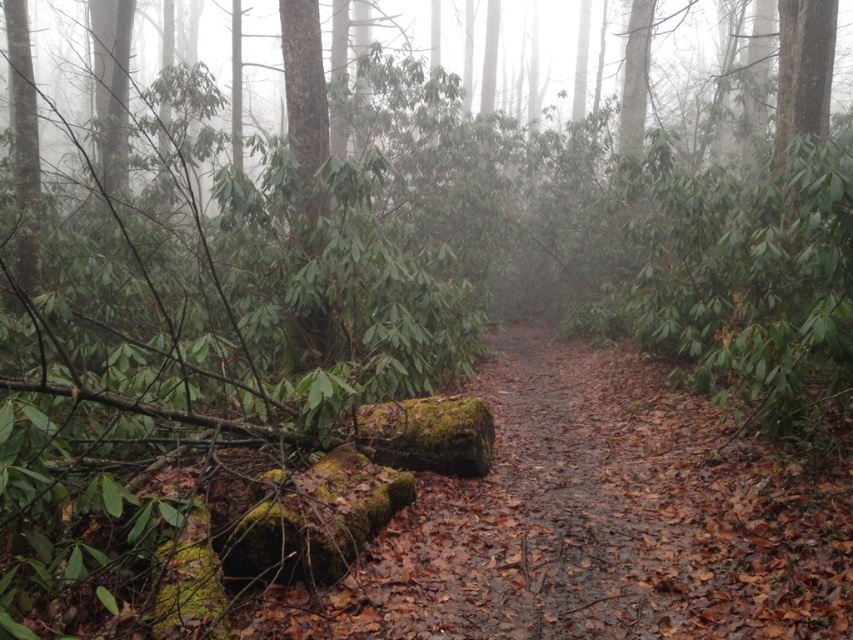
You are a hiker who needs to cross the narrow dirt path in the forest. You see the green mossy tree trunk at center and the green mossy log at left. Which object is closer to you as you stand on the path?

The green mossy log at left is closer to you than the green mossy tree trunk at center since it is only 4.73 meters away.

You are standing at the edge of the forest and see the point marked as (305,99). What object does this point correspond to in the scene?

The point marked as (305,99) corresponds to the green mossy tree trunk at center.